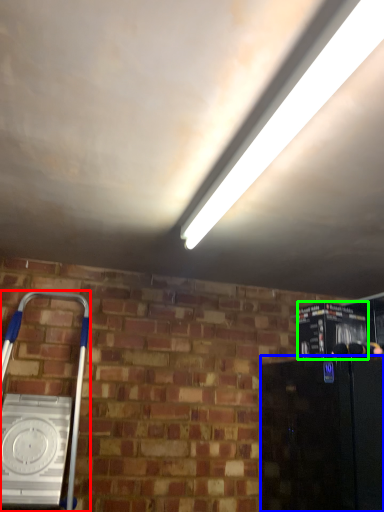
Question: Estimate the real-world distances between objects in this image. Which object is farther from home appliance (highlighted by a red box), appliance (highlighted by a blue box) or appliance (highlighted by a green box)?

Choices:
 (A) appliance
 (B) appliance

Answer: (B)